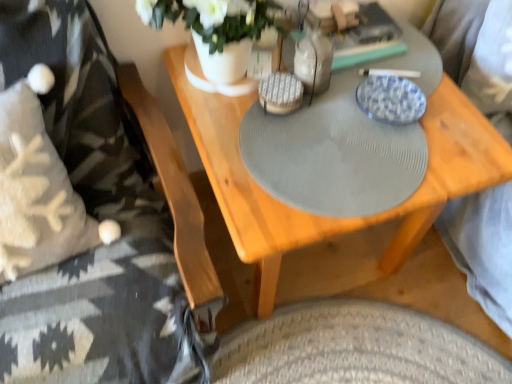
Find the location of a particular element. vacant space in between blue glazed plate at upper center and clear glass bottle at center is located at coordinates (347, 97).